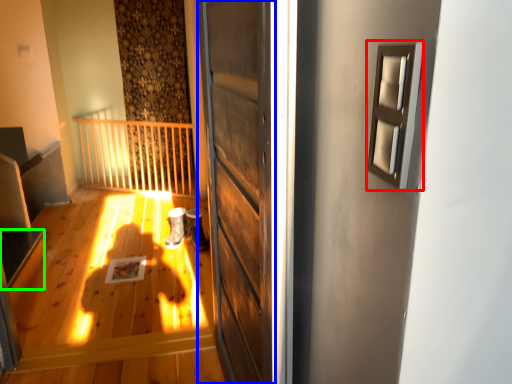
Question: Estimate the real-world distances between objects in this image. Which object is closer to window (highlighted by a red box), door (highlighted by a blue box) or stairwell (highlighted by a green box)?

Choices:
 (A) door
 (B) stairwell

Answer: (A)